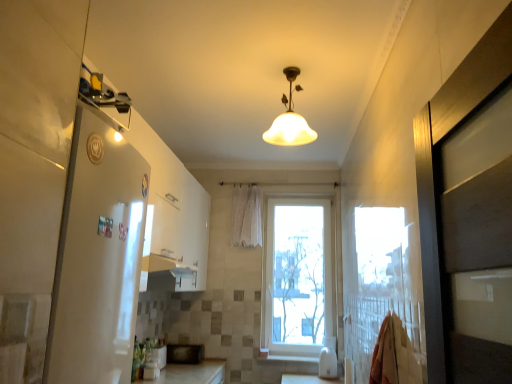
What do you see at coordinates (246, 216) in the screenshot?
I see `white sheer curtain at center` at bounding box center [246, 216].

Identify the location of matte glass lampshade at center. This screenshot has height=384, width=512. (289, 120).

Who is taller, white glossy microwave at lower center, which appears as the 2th appliance when viewed from the back, or white sheer curtain at center?

With more height is white sheer curtain at center.

Is white glossy microwave at lower center, acting as the first appliance starting from the front, next to white sheer curtain at center?

No, white glossy microwave at lower center, acting as the first appliance starting from the front, is not making contact with white sheer curtain at center.

How different are the orientations of white glossy microwave at lower center, which appears as the 2th appliance when viewed from the back, and white sheer curtain at center in degrees?

The angle between the facing direction of white glossy microwave at lower center, which appears as the 2th appliance when viewed from the back, and the facing direction of white sheer curtain at center is 89.7 degrees.

Identify the location of shower curtain that appears above the white glossy microwave at lower center, acting as the first appliance starting from the front (from the image's perspective). (246, 216).

From a real-world perspective, who is located lower, matte glass lampshade at center or white plastic window at center?

white plastic window at center is physically lower.

Who is bigger, matte glass lampshade at center or white plastic window at center?

white plastic window at center.

Are black matte microwave at center, which is the 2th appliance in front-to-back order, and matte glass lampshade at center located far from each other?

black matte microwave at center, which is the 2th appliance in front-to-back order, is far away from matte glass lampshade at center.

From a real-world perspective, which object rests below the other?

black matte microwave at center, which is the 2th appliance in front-to-back order, is physically lower.

Is point (181, 357) more distant than point (308, 142)?

Yes, it is behind point (308, 142).

From a real-world perspective, count 2nd appliances downward from the matte glass lampshade at center and point to it. Please provide its 2D coordinates.

[(185, 353)]

Who is smaller, white plastic window at center or white glossy microwave at lower center, which appears as the 2th appliance when viewed from the back?

With smaller size is white glossy microwave at lower center, which appears as the 2th appliance when viewed from the back.

From a real-world perspective, is white plastic window at center beneath white glossy microwave at lower center, acting as the first appliance starting from the front?

Incorrect, from a real-world perspective, white plastic window at center is higher than white glossy microwave at lower center, acting as the first appliance starting from the front.

Is white plastic window at center inside or outside of white glossy microwave at lower center, which appears as the 2th appliance when viewed from the back?

white plastic window at center cannot be found inside white glossy microwave at lower center, which appears as the 2th appliance when viewed from the back.

Which is nearer, (271,241) or (165,354)?

Point (271,241) is positioned farther from the camera compared to point (165,354).

Is white sheer curtain at center facing towards white glossy refrigerator at left?

Yes, white sheer curtain at center is oriented towards white glossy refrigerator at left.

Which object is positioned more to the left, white sheer curtain at center or white glossy refrigerator at left?

white glossy refrigerator at left.

Is white sheer curtain at center inside the boundaries of white glossy refrigerator at left, or outside?

white sheer curtain at center is outside white glossy refrigerator at left.

Is white sheer curtain at center positioned far away from white glossy refrigerator at left?

Indeed, white sheer curtain at center is not near white glossy refrigerator at left.

Is white sheer curtain at center a part of matte glass lampshade at center?

No, white sheer curtain at center is located outside of matte glass lampshade at center.

From the picture: Are matte glass lampshade at center and white sheer curtain at center making contact?

No, matte glass lampshade at center is not next to white sheer curtain at center.

From the picture: Considering the relative sizes of matte glass lampshade at center and white sheer curtain at center in the image provided, is matte glass lampshade at center shorter than white sheer curtain at center?

Indeed, matte glass lampshade at center has a lesser height compared to white sheer curtain at center.

Which object is thinner, matte glass lampshade at center or white sheer curtain at center?

white sheer curtain at center.

From the image's perspective, is white glossy refrigerator at left positioned above or below white plastic window at center?

Clearly, from the image's perspective, white glossy refrigerator at left is above white plastic window at center.

Can you confirm if white glossy refrigerator at left is thinner than white plastic window at center?

A: No, white glossy refrigerator at left is not thinner than white plastic window at center.

How different are the orientations of white glossy refrigerator at left and white plastic window at center in degrees?

They differ by 90.9 degrees in their facing directions.

Considering the positions of objects white glossy refrigerator at left and white plastic window at center in the image provided, who is more to the left, white glossy refrigerator at left or white plastic window at center?

Positioned to the left is white glossy refrigerator at left.

You are a GUI agent. You are given a task and a screenshot of the screen. Output one action in this format:
    pyautogui.click(x=<x>, y=<y>)
    Task: Click on the appliance that is the 2nd one when counting leftward from the white sheer curtain at center
    The width and height of the screenshot is (512, 384).
    Given the screenshot: What is the action you would take?
    pyautogui.click(x=157, y=356)

Find the location of a particular element. The image size is (512, 384). window that is behind the matte glass lampshade at center is located at coordinates (298, 276).

Estimate the real-world distances between objects in this image. Which object is further from white glossy refrigerator at left, black matte microwave at center, which is counted as the first appliance, starting from the back, or white glossy wood at lower center?

white glossy wood at lower center is further to white glossy refrigerator at left.

Considering their positions, is white glossy microwave at lower center, which appears as the 2th appliance when viewed from the back, positioned closer to white sheer curtain at center than white glossy wood at lower center?

Among the two, white glossy wood at lower center is located nearer to white sheer curtain at center.

When comparing their distances from white sheer curtain at center, does black matte microwave at center, which is counted as the first appliance, starting from the back, or white glossy microwave at lower center, which appears as the 2th appliance when viewed from the back, seem closer?

Among the two, black matte microwave at center, which is counted as the first appliance, starting from the back, is located nearer to white sheer curtain at center.

Looking at this image, looking at the image, which one is located further to black matte microwave at center, which is the 2th appliance in front-to-back order, white plastic window at center or white glossy refrigerator at left?

The object further to black matte microwave at center, which is the 2th appliance in front-to-back order, is white glossy refrigerator at left.

Based on their spatial positions, is white glossy wood at lower center or matte glass lampshade at center further from white plastic window at center?

matte glass lampshade at center is positioned further to the anchor white plastic window at center.

When comparing their distances from black matte microwave at center, which is counted as the first appliance, starting from the back, does white sheer curtain at center or white plastic window at center seem further?

white sheer curtain at center.

Which object lies nearer to the anchor point white glossy wood at lower center, white glossy microwave at lower center, which appears as the 2th appliance when viewed from the back, or black matte microwave at center, which is counted as the first appliance, starting from the back?

black matte microwave at center, which is counted as the first appliance, starting from the back, is positioned closer to the anchor white glossy wood at lower center.

Estimate the real-world distances between objects in this image. Which object is closer to white plastic window at center, black matte microwave at center, which is counted as the first appliance, starting from the back, or white sheer curtain at center?

Among the two, white sheer curtain at center is located nearer to white plastic window at center.

Find the location of `appliance between white glossy microwave at lower center, acting as the first appliance starting from the front, and white glossy wood at lower center from left to right`. appliance between white glossy microwave at lower center, acting as the first appliance starting from the front, and white glossy wood at lower center from left to right is located at coordinates (185, 353).

Where is `shower curtain between matte glass lampshade at center and white glossy microwave at lower center, acting as the first appliance starting from the front, in the up-down direction`? The image size is (512, 384). shower curtain between matte glass lampshade at center and white glossy microwave at lower center, acting as the first appliance starting from the front, in the up-down direction is located at coordinates (246, 216).

I want to click on window positioned between white glossy refrigerator at left and white sheer curtain at center from near to far, so click(298, 276).

This screenshot has width=512, height=384. Identify the location of lamp located between white glossy refrigerator at left and white plastic window at center in the depth direction. (289, 120).